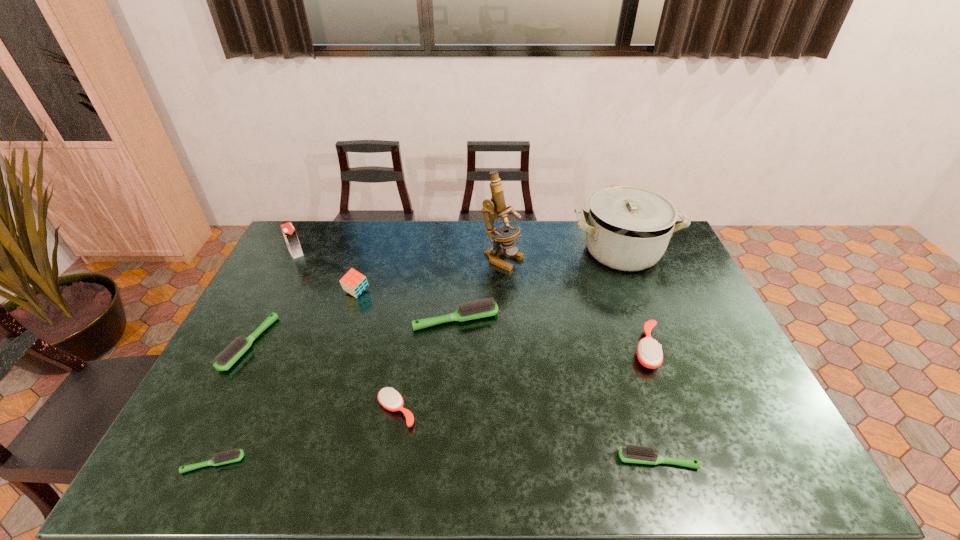
The height and width of the screenshot is (540, 960). What are the coordinates of `the tallest object` in the screenshot? It's located at (497, 203).

You are a GUI agent. You are given a task and a screenshot of the screen. Output one action in this format:
    pyautogui.click(x=<x>, y=<y>)
    Task: Click on the white saucepan
    
    Given the screenshot: What is the action you would take?
    pyautogui.click(x=628, y=227)

The height and width of the screenshot is (540, 960). Find the location of `the second tallest object`. the second tallest object is located at coordinates (628, 227).

You are a GUI agent. You are given a task and a screenshot of the screen. Output one action in this format:
    pyautogui.click(x=<x>, y=<y>)
    Task: Click on the orange juice
    This screenshot has width=960, height=540.
    Given the screenshot: What is the action you would take?
    pyautogui.click(x=289, y=232)

Where is `orange orange juice`? The image size is (960, 540). orange orange juice is located at coordinates (289, 232).

At what (x,y) coordinates should I click in order to perform the action: click on cube. Please return your answer as a coordinate pair (x, y). Looking at the image, I should click on (353, 282).

You are a GUI agent. You are given a task and a screenshot of the screen. Output one action in this format:
    pyautogui.click(x=<x>, y=<y>)
    Task: Click on the red cube
    This screenshot has width=960, height=540.
    Given the screenshot: What is the action you would take?
    pyautogui.click(x=353, y=282)

This screenshot has width=960, height=540. I want to click on the bigger orange hairbrush, so click(649, 353).

Where is `the right orange hairbrush`? The width and height of the screenshot is (960, 540). the right orange hairbrush is located at coordinates (649, 353).

This screenshot has width=960, height=540. I want to click on the biggest light hairbrush, so click(487, 307).